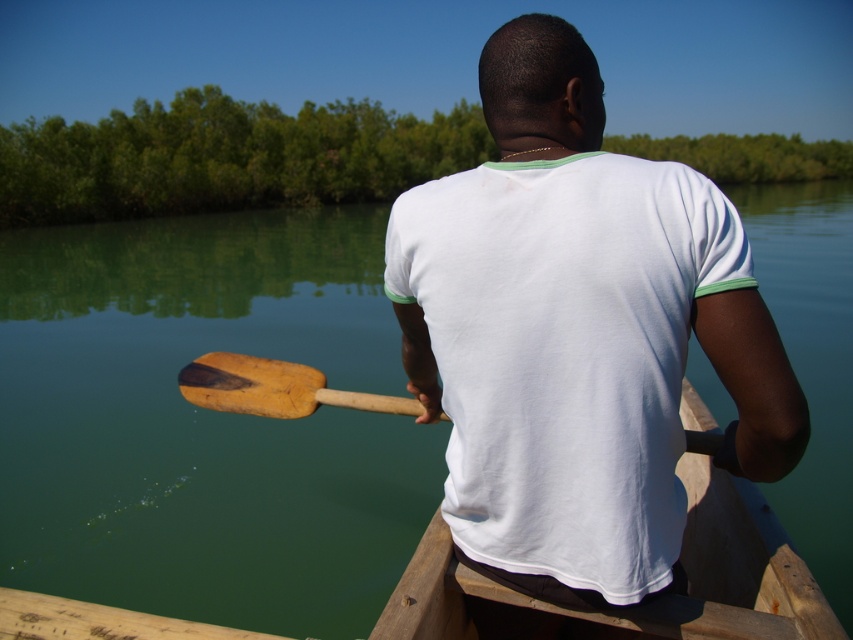
You are planning to place a 24 inch long object between the white cotton shirt at center and the wooden canoe at center. Is there enough space?

The distance between the white cotton shirt at center and the wooden canoe at center is 22.45 inches, which is less than the 24 inch long object. Therefore, there isn not enough space to place the object between them.

You are standing on the shore looking at the scene. Where is the green smooth water at center located in terms of coordinates?

The green smooth water at center is located at the coordinates point (206, 420).

You are a passenger in the wooden canoe at center. You want to see the green smooth water at center. Which direction should you look?

The green smooth water at center is above the wooden canoe at center, so you should look upward to see it.